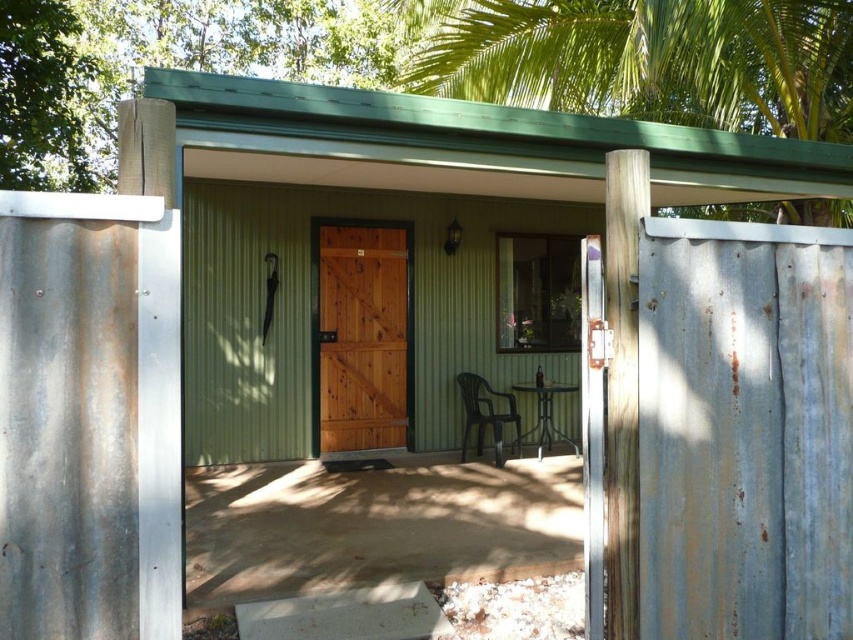
Is point (550, 8) more distant than point (508, 397)?

Yes, it is behind point (508, 397).

Looking at this image, can you confirm if green leafy palm tree at upper center is taller than black plastic chair at center?

Correct, green leafy palm tree at upper center is much taller as black plastic chair at center.

Identify the location of green leafy palm tree at upper center. (643, 60).

The height and width of the screenshot is (640, 853). What are the coordinates of `green leafy palm tree at upper center` in the screenshot? It's located at coord(643,60).

Is green leafy palm tree at upper center closer to the viewer compared to wooden door at center?

Yes, it is in front of wooden door at center.

Between green leafy palm tree at upper center and wooden door at center, which one is positioned higher?

green leafy palm tree at upper center is higher up.

I want to click on green leafy palm tree at upper center, so click(x=643, y=60).

Can you confirm if wooden door at center is positioned above black plastic chair at center?

Yes.

How far apart are wooden door at center and black plastic chair at center?

wooden door at center is 1.03 meters from black plastic chair at center.

Between point (392, 248) and point (505, 413), which one is positioned in front?

Point (505, 413) is in front.

You are a GUI agent. You are given a task and a screenshot of the screen. Output one action in this format:
    pyautogui.click(x=<x>, y=<y>)
    Task: Click on the wooden door at center
    
    Given the screenshot: What is the action you would take?
    pyautogui.click(x=361, y=339)